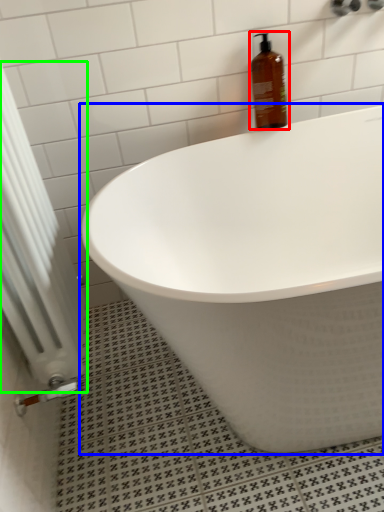
Question: Considering the real-world distances, which object is farthest from bottle (highlighted by a red box)? bathtub (highlighted by a blue box) or radiator (highlighted by a green box)?

Choices:
 (A) bathtub
 (B) radiator

Answer: (B)